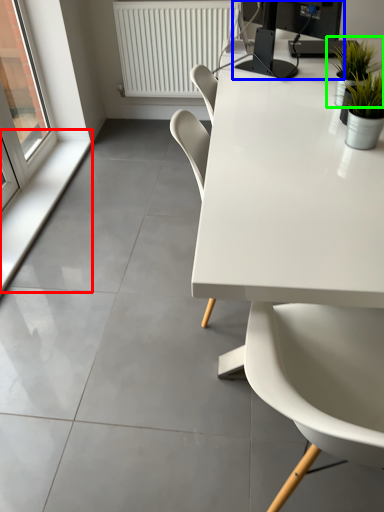
Question: Based on their relative distances, which object is nearer to window sill (highlighted by a red box)? Choose from desktop computer (highlighted by a blue box) and houseplant (highlighted by a green box).

Choices:
 (A) desktop computer
 (B) houseplant

Answer: (A)